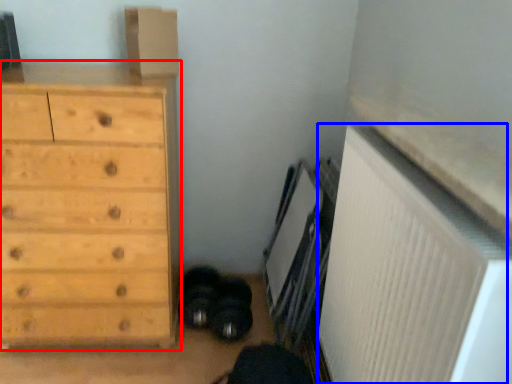
Question: Among these objects, which one is farthest to the camera, chest of drawers (highlighted by a red box) or radiator (highlighted by a blue box)?

Choices:
 (A) chest of drawers
 (B) radiator

Answer: (A)